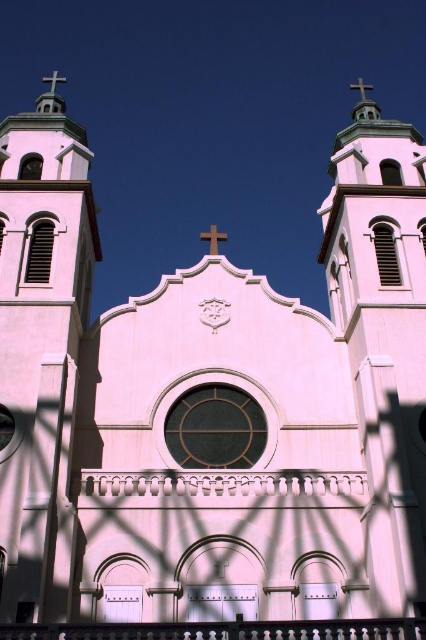
Question: Does white stone cross at left come in front of white stone tower at upper right?

Choices:
 (A) no
 (B) yes

Answer: (A)

Question: Can you confirm if white stone cross at left is positioned to the left of white stone tower at upper right?

Choices:
 (A) yes
 (B) no

Answer: (A)

Question: From the image, what is the correct spatial relationship of white stone cross at left in relation to white stone tower at upper right?

Choices:
 (A) right
 (B) left

Answer: (B)

Question: Which point is farther to the camera?

Choices:
 (A) (357, 112)
 (B) (63, 236)

Answer: (A)